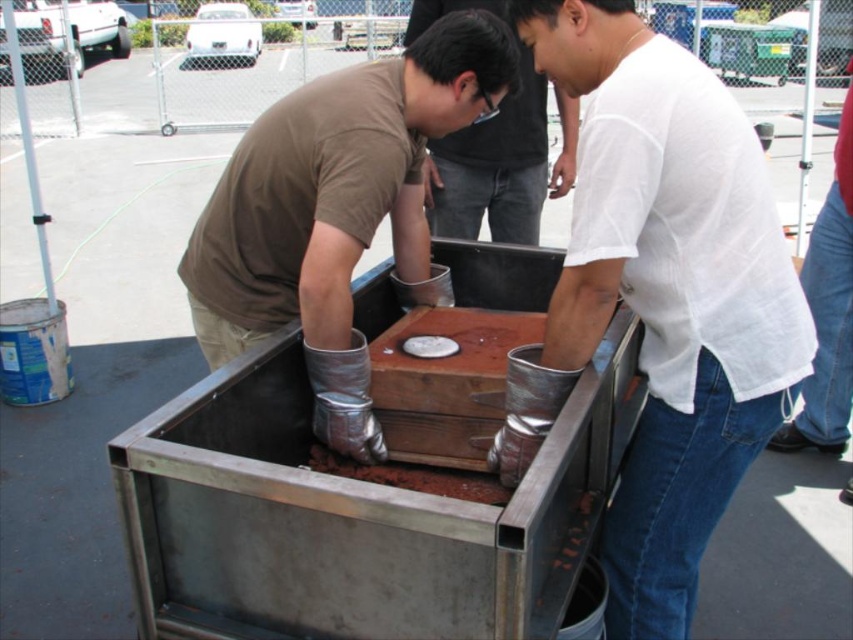
You are a safety inspector observing the scene. You notice the silver metallic gloves at center and the matte black shirt at center. According to safety protocols, which item should be visible to ensure proper protection? Explain your reasoning.

The silver metallic gloves at center should be visible because they are in front of the matte black shirt at center, ensuring that the gloves are properly covering the hands and providing necessary protection.

You are a safety inspector checking the equipment of workers near a hazardous material container. You notice the silver metallic gloves at center and the matte black shirt at center. Which piece of equipment is positioned to the left of the other?

The silver metallic gloves at center is to the left of matte black shirt at center according to the description.

You are a safety inspector evaluating the scene. You notice the silver metallic gloves at center and the matte black shirt at center. Based on their widths, which object might pose a risk if they were to be placed side by side in a confined space?

The silver metallic gloves at center are wider than the matte black shirt at center, so placing them side by side in a confined space might pose a risk due to their larger width.